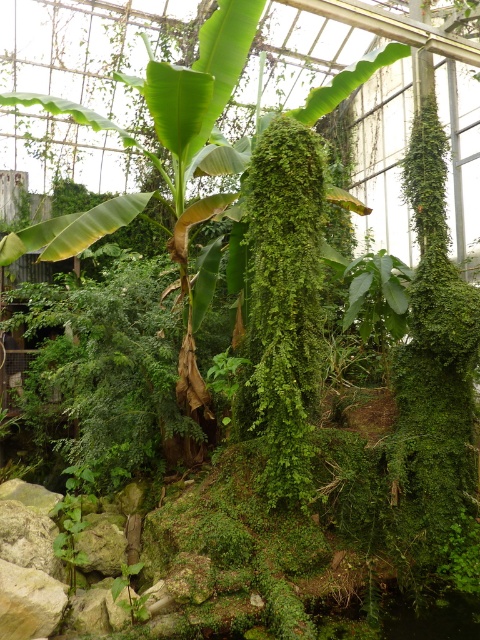
Which is above, green leafy banana tree at center or green fuzzy fern at center?

green leafy banana tree at center is higher up.

Looking at this image, does green leafy banana tree at center have a smaller size compared to green fuzzy fern at center?

Incorrect, green leafy banana tree at center is not smaller in size than green fuzzy fern at center.

Who is more distant from viewer, (191, 289) or (240, 412)?

The point (191, 289) is more distant.

Find the location of a particular element. green leafy banana tree at center is located at coordinates (160, 163).